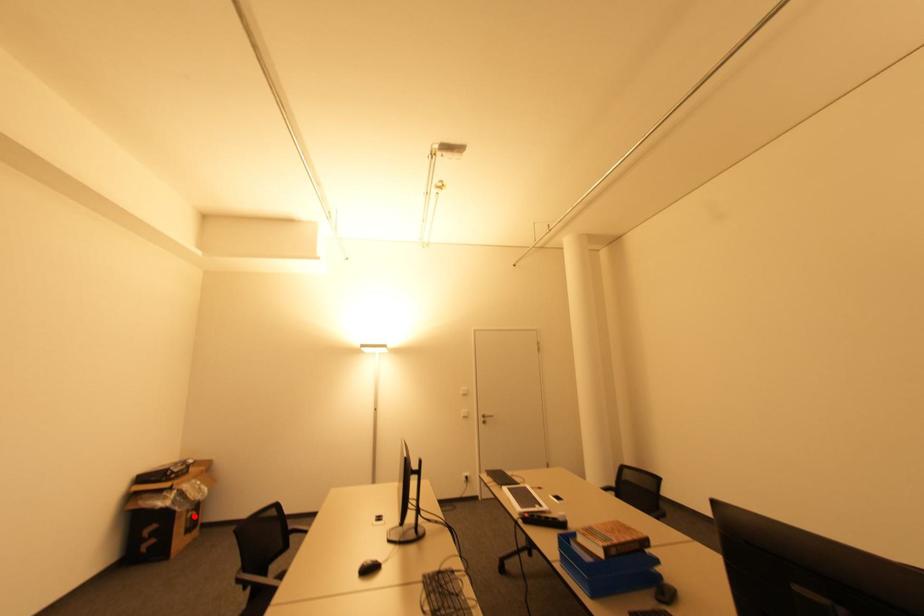
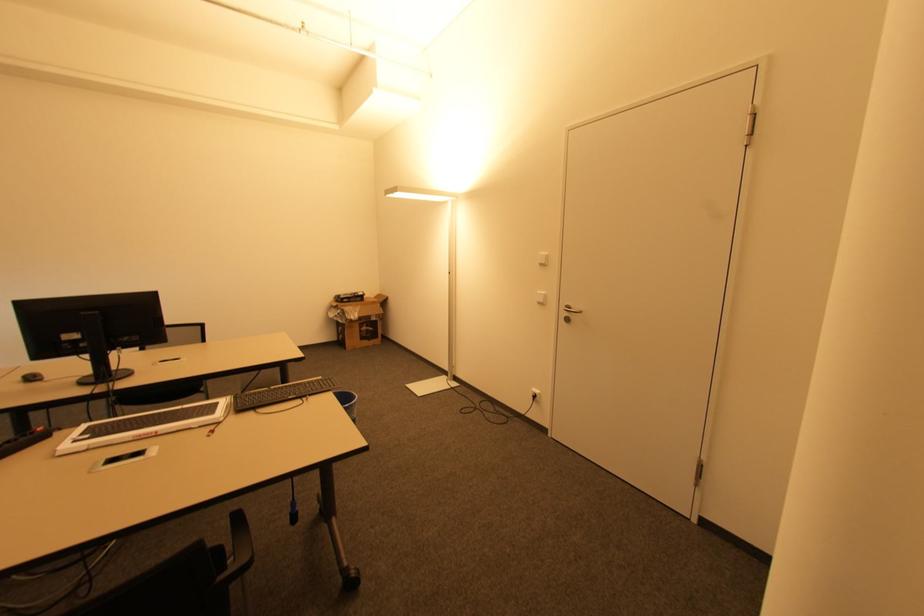
Question: I am providing you with two images of the same scene from different viewpoints. A red point is shown in image1. For the corresponding object point in image2, is it positioned nearer or farther from the camera?

Choices:
 (A) Nearer
 (B) Farther

Answer: (A)